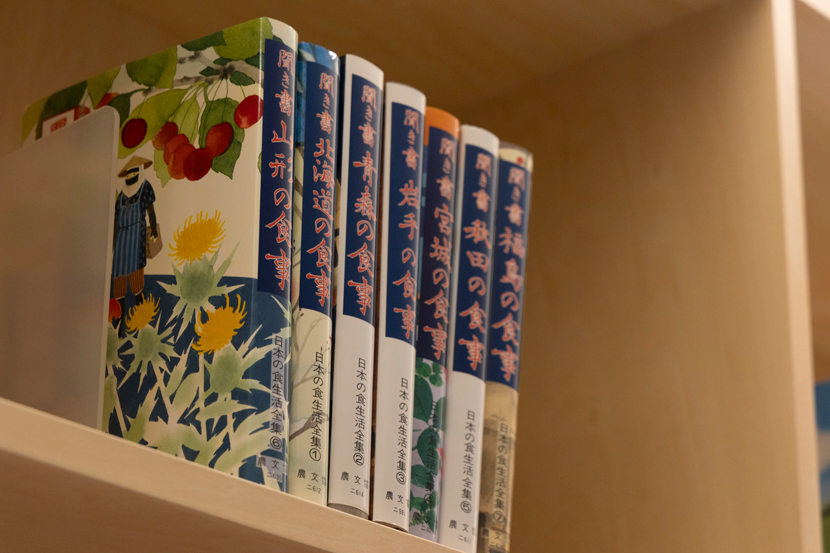
Find the location of a particular element. The image size is (830, 553). books on a shelf is located at coordinates (269, 292), (314, 295), (347, 312), (388, 324), (432, 331), (461, 354), (499, 375).